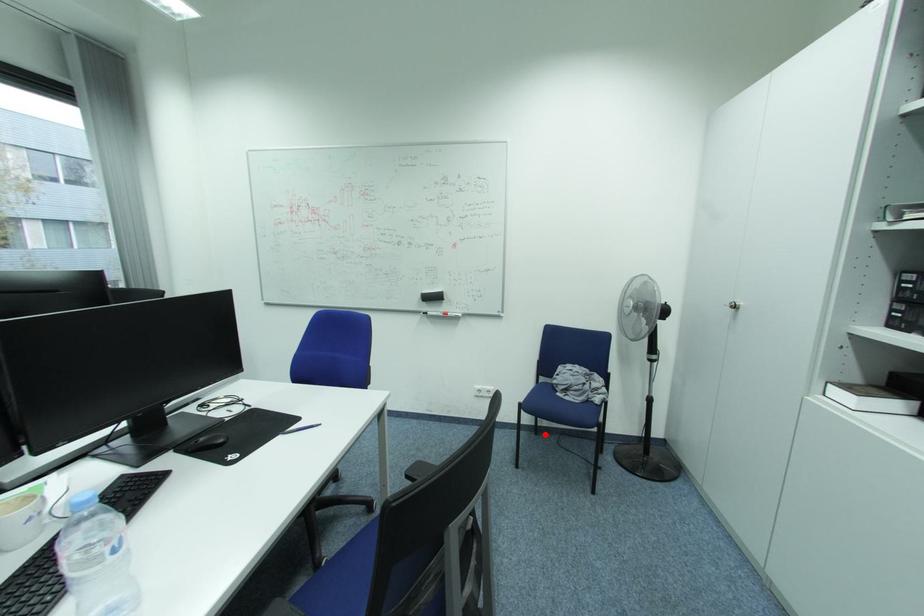
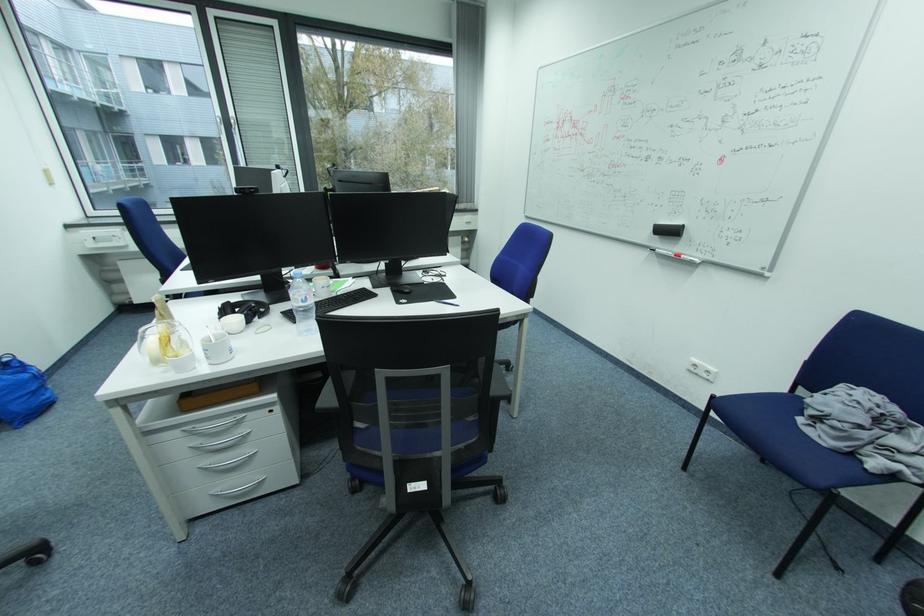
The point at the highlighted location is marked in the first image. Where is the corresponding point in the second image?

(772, 463)